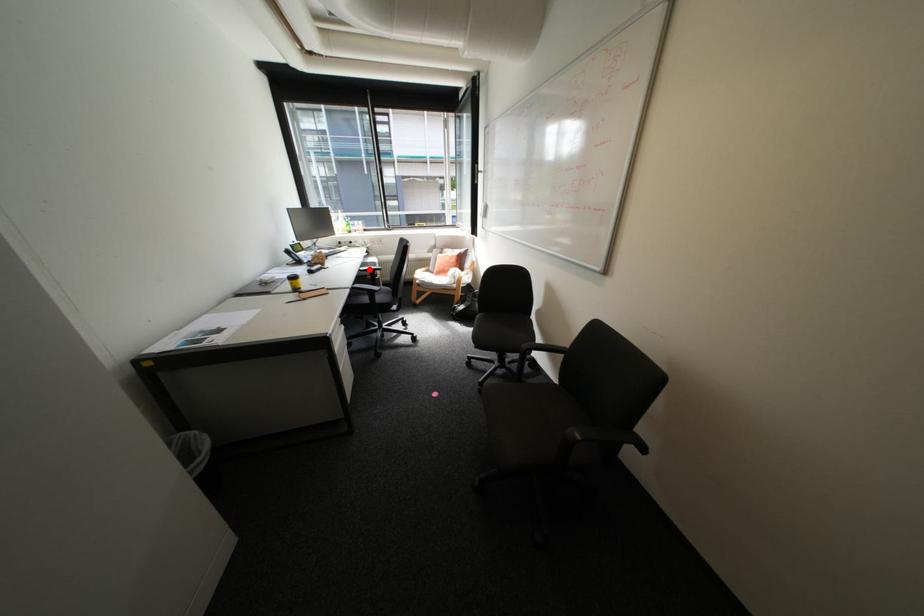
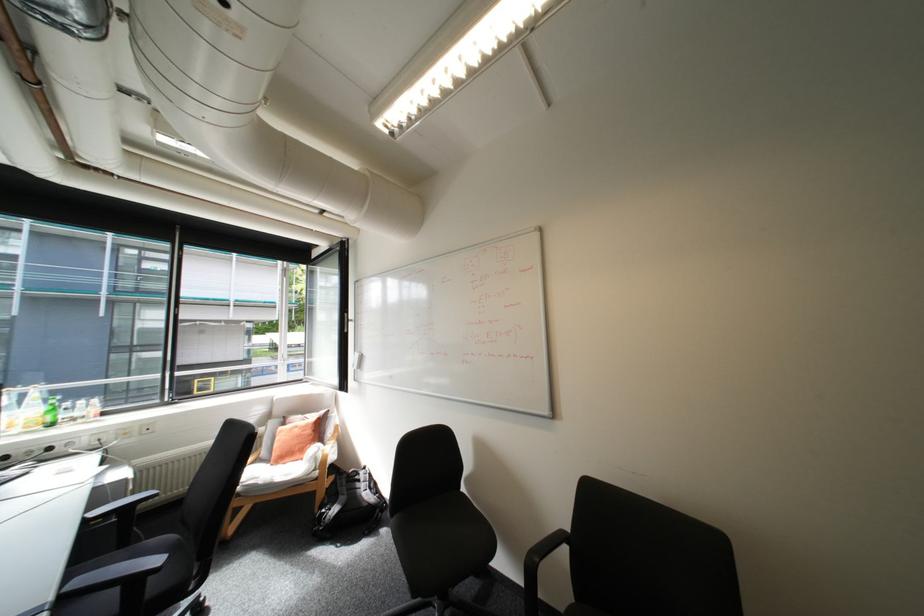
Where in the second image is the point corresponding to the highlighted location from the first image?

(94, 519)